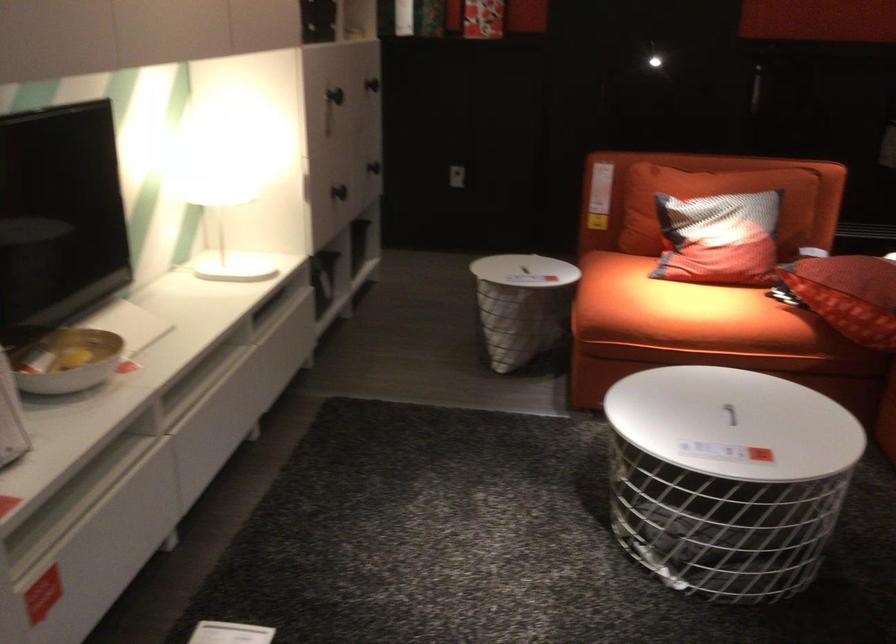
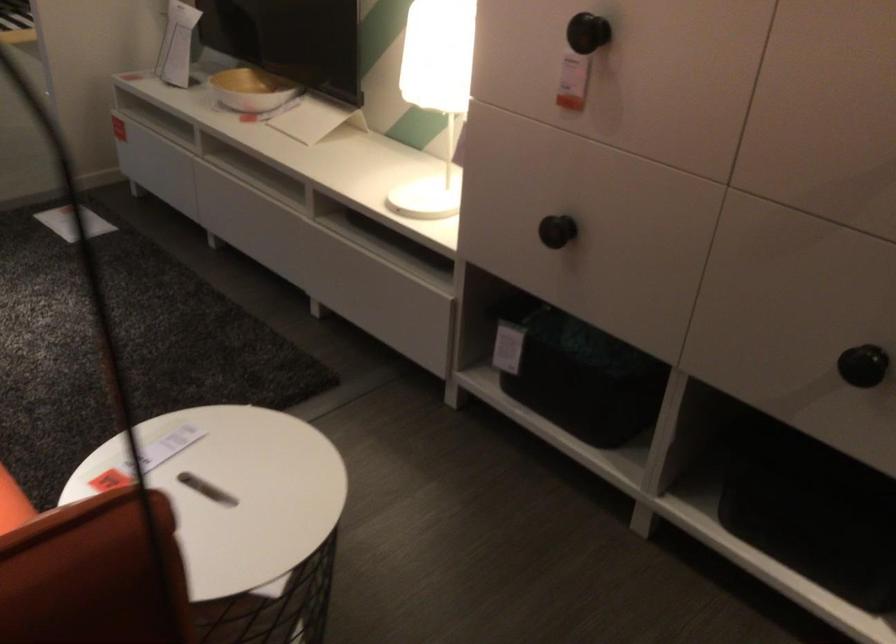
Find the pixel in the second image that matches the point at 259,185 in the first image.

(435, 93)